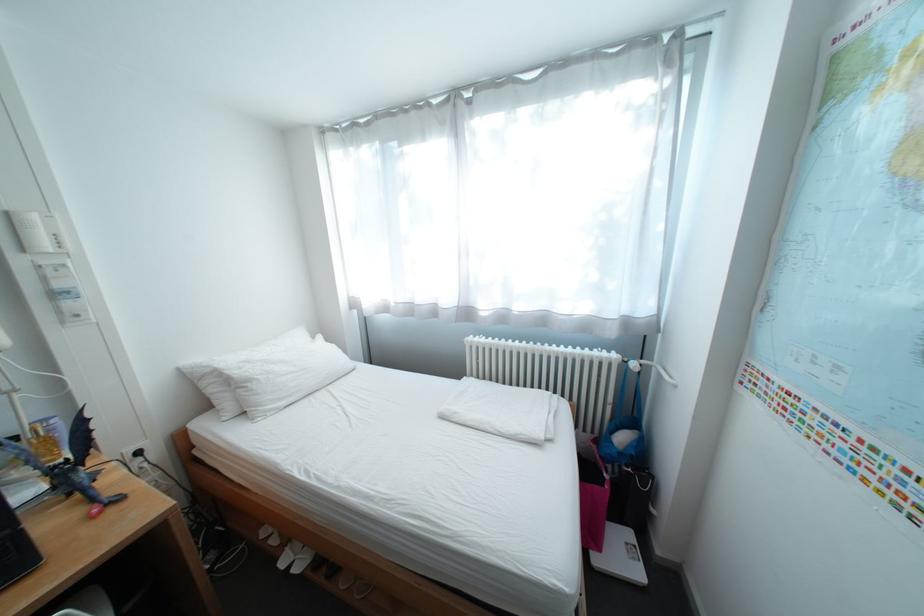
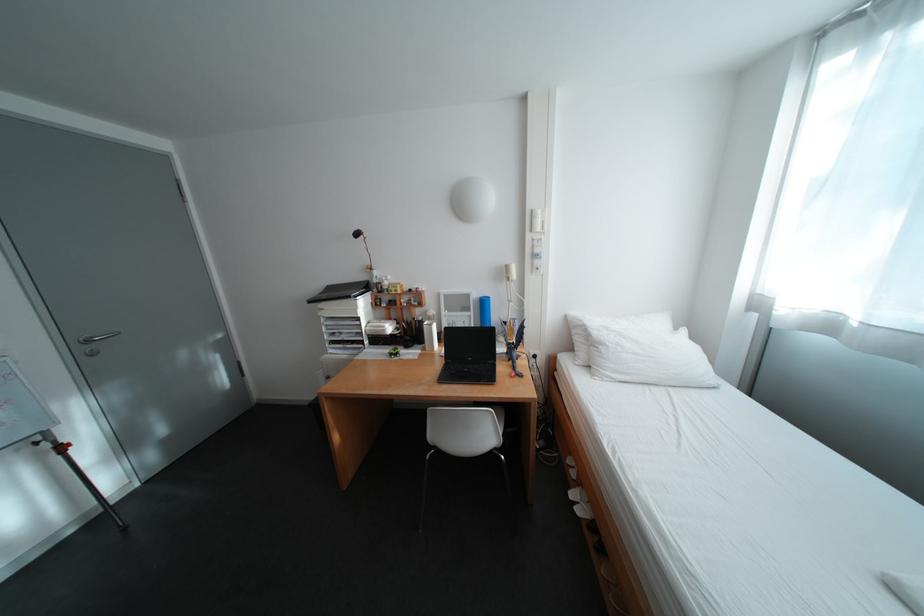
Locate, in the second image, the point that corresponds to the point at 42,464 in the first image.

(517, 338)